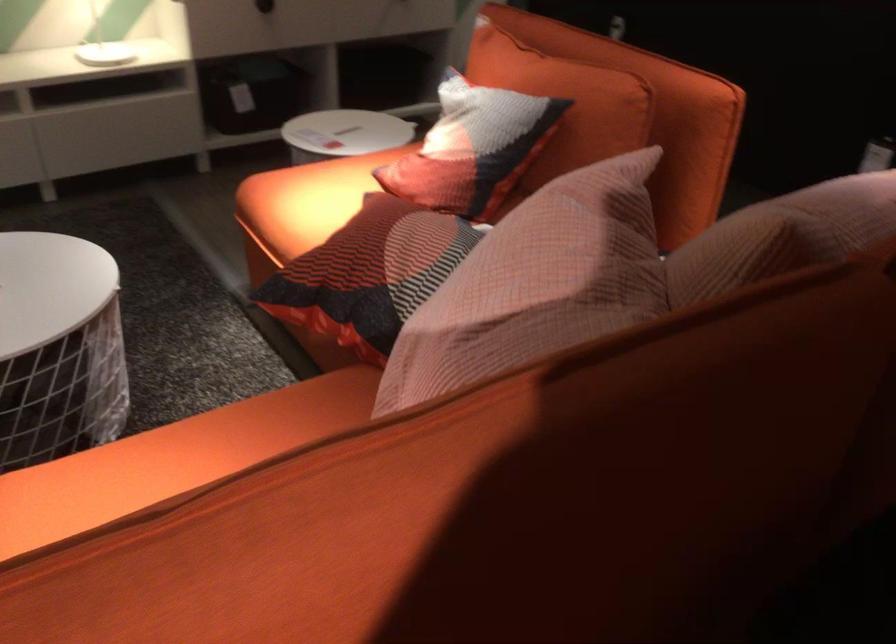
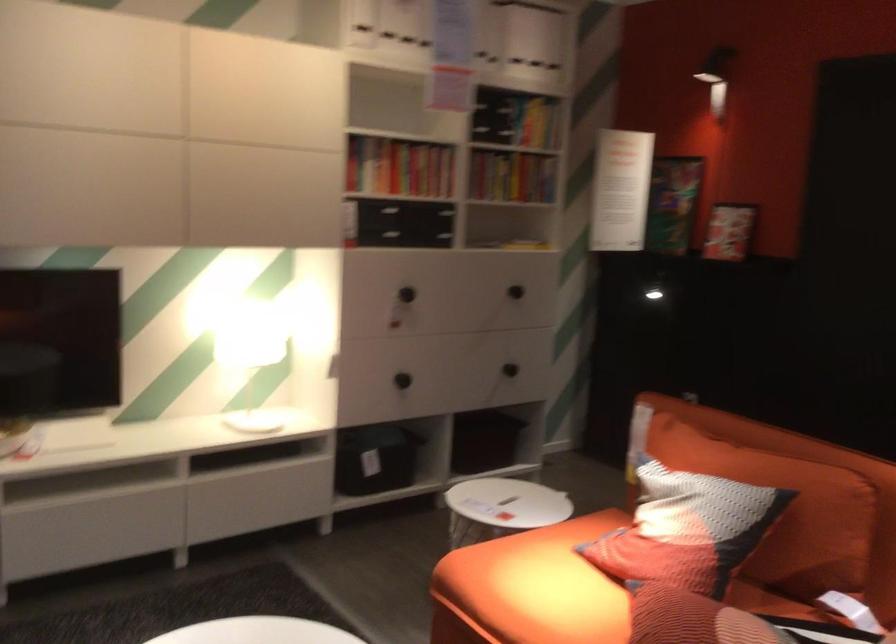
Find the pixel in the second image that matches the point at 313,205 in the first image.

(531, 588)